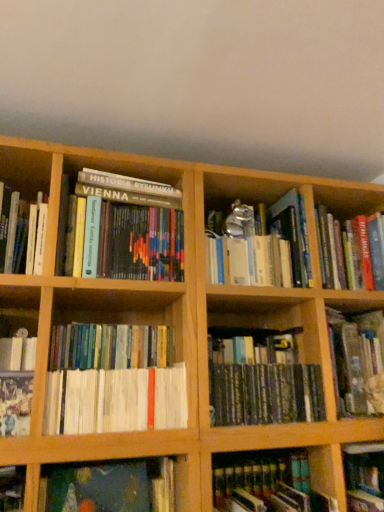
Question: Can you confirm if hardcover book at center, the 4th book positioned from the right, is smaller than white paperbacks at center, marked as the sixth book in a right-to-left arrangement?

Choices:
 (A) no
 (B) yes

Answer: (A)

Question: From a real-world perspective, is hardcover book at center, the 4th book positioned from the right, on top of white paperbacks at center, marked as the sixth book in a right-to-left arrangement?

Choices:
 (A) no
 (B) yes

Answer: (A)

Question: Does hardcover book at center, the 6th book in the left-to-right sequence, have a greater width compared to white paperbacks at center, marked as the sixth book in a right-to-left arrangement?

Choices:
 (A) yes
 (B) no

Answer: (A)

Question: From the image's perspective, would you say hardcover book at center, the 4th book positioned from the right, is positioned over white paperbacks at center, arranged as the 4th book when viewed from the left?

Choices:
 (A) no
 (B) yes

Answer: (A)

Question: Does hardcover book at center, the 4th book positioned from the right, turn towards white paperbacks at center, marked as the sixth book in a right-to-left arrangement?

Choices:
 (A) no
 (B) yes

Answer: (A)

Question: Is hardcover book at center, the 6th book in the left-to-right sequence, wider or thinner than metallic silver spoon at center, which is the 7th book from left to right?

Choices:
 (A) thin
 (B) wide

Answer: (A)

Question: From a real-world perspective, is hardcover book at center, the 4th book positioned from the right, above or below metallic silver spoon at center, the third book from the right?

Choices:
 (A) above
 (B) below

Answer: (B)

Question: From the image's perspective, is hardcover book at center, the 6th book in the left-to-right sequence, positioned above or below metallic silver spoon at center, the third book from the right?

Choices:
 (A) below
 (B) above

Answer: (A)

Question: Relative to metallic silver spoon at center, which is the 7th book from left to right, is hardcover book at center, the 6th book in the left-to-right sequence, in front or behind?

Choices:
 (A) behind
 (B) front

Answer: (B)

Question: Based on their sizes in the image, would you say metallic silver spoon at center, the third book from the right, is bigger or smaller than dark green canvas painting at lower left, which is the 5th book in left-to-right order?

Choices:
 (A) big
 (B) small

Answer: (A)

Question: Is metallic silver spoon at center, which is the 7th book from left to right, taller or shorter than dark green canvas painting at lower left, which is the 5th book in left-to-right order?

Choices:
 (A) short
 (B) tall

Answer: (B)

Question: Which is correct: metallic silver spoon at center, the third book from the right, is inside dark green canvas painting at lower left, acting as the 5th book starting from the right, or outside of it?

Choices:
 (A) inside
 (B) outside

Answer: (B)

Question: Is point (306, 224) positioned closer to the camera than point (105, 489)?

Choices:
 (A) closer
 (B) farther

Answer: (B)

Question: Would you say hardcover book at lower left, which is counted as the 1th book, starting from the left, is to the left or to the right of white paper book at lower left, arranged as the 2th book when viewed from the left, in the picture?

Choices:
 (A) right
 (B) left

Answer: (B)

Question: In terms of width, does hardcover book at lower left, positioned as the 9th book in right-to-left order, look wider or thinner when compared to white paper book at lower left, arranged as the 2th book when viewed from the left?

Choices:
 (A) wide
 (B) thin

Answer: (B)